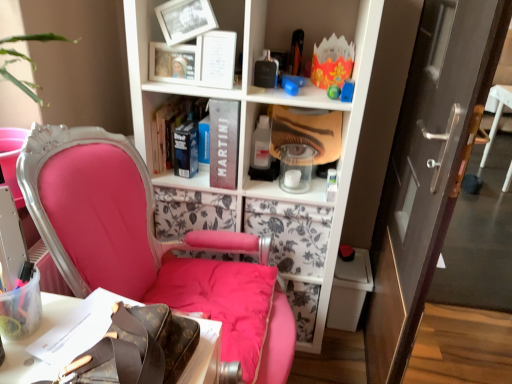
Question: Does matte black book at center, which is counted as the second book, starting from the left, lie behind brown leather bag at lower left?

Choices:
 (A) yes
 (B) no

Answer: (A)

Question: Is matte black book at center, the 1th book in the right-to-left sequence, positioned beyond the bounds of brown leather bag at lower left?

Choices:
 (A) no
 (B) yes

Answer: (B)

Question: Considering the relative sizes of matte black book at center, the 1th book in the right-to-left sequence, and brown leather bag at lower left in the image provided, is matte black book at center, the 1th book in the right-to-left sequence, thinner than brown leather bag at lower left?

Choices:
 (A) no
 (B) yes

Answer: (B)

Question: Is matte black book at center, the 1th book in the right-to-left sequence, taller than brown leather bag at lower left?

Choices:
 (A) no
 (B) yes

Answer: (B)

Question: Considering the relative sizes of matte black book at center, the 1th book in the right-to-left sequence, and brown leather bag at lower left in the image provided, is matte black book at center, the 1th book in the right-to-left sequence, shorter than brown leather bag at lower left?

Choices:
 (A) yes
 (B) no

Answer: (B)

Question: From a real-world perspective, is hardcover book at center, which is counted as the second book, starting from the right, above or below matte black book at center, which is counted as the second book, starting from the left?

Choices:
 (A) below
 (B) above

Answer: (A)

Question: In the image, is hardcover book at center, which ranks as the first book in left-to-right order, positioned in front of or behind matte black book at center, the 1th book in the right-to-left sequence?

Choices:
 (A) front
 (B) behind

Answer: (B)

Question: From the image's perspective, is hardcover book at center, which is counted as the second book, starting from the right, located above or below matte black book at center, the 1th book in the right-to-left sequence?

Choices:
 (A) above
 (B) below

Answer: (A)

Question: In terms of height, does hardcover book at center, which is counted as the second book, starting from the right, look taller or shorter compared to matte black book at center, the 1th book in the right-to-left sequence?

Choices:
 (A) tall
 (B) short

Answer: (B)

Question: From a real-world perspective, is matte black book at center, which is counted as the second book, starting from the left, physically located above or below matte pink chair at left?

Choices:
 (A) above
 (B) below

Answer: (A)

Question: Looking at their shapes, would you say matte black book at center, the 1th book in the right-to-left sequence, is wider or thinner than matte pink chair at left?

Choices:
 (A) thin
 (B) wide

Answer: (A)

Question: Considering the positions of point (211, 178) and point (94, 223), is point (211, 178) closer or farther from the camera than point (94, 223)?

Choices:
 (A) closer
 (B) farther

Answer: (B)

Question: Choose the correct answer: Is matte black book at center, which is counted as the second book, starting from the left, inside matte pink chair at left or outside it?

Choices:
 (A) outside
 (B) inside

Answer: (A)

Question: Based on their positions, is matte pink chair at left located to the left or right of brown leather bag at lower left?

Choices:
 (A) left
 (B) right

Answer: (B)

Question: From a real-world perspective, is matte pink chair at left positioned above or below brown leather bag at lower left?

Choices:
 (A) below
 (B) above

Answer: (A)